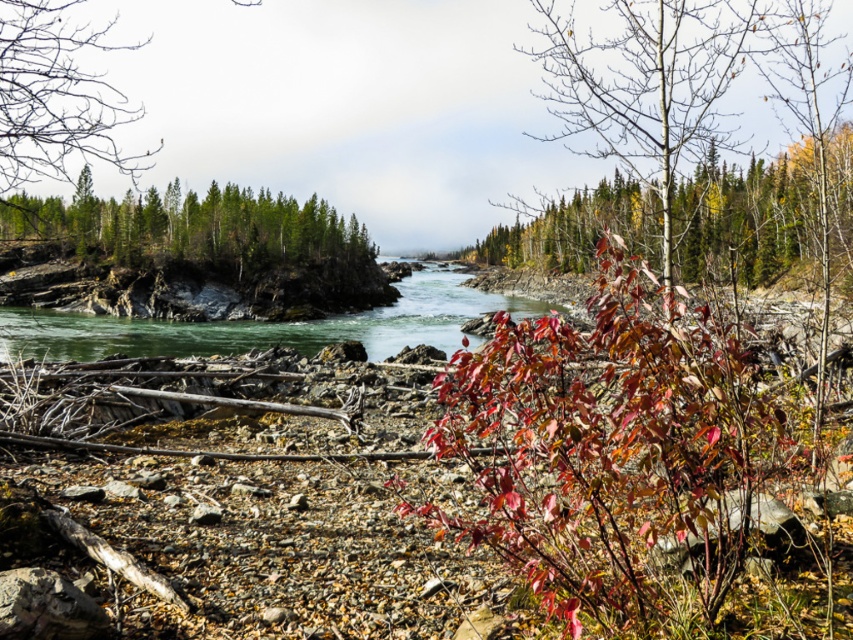
Who is positioned more to the left, leaves at upper right or green smooth water at center?

green smooth water at center

Looking at this image, is leaves at upper right thinner than green smooth water at center?

Yes.

Who is more forward, (843,140) or (79,339)?

Point (79,339) is in front.

At what (x,y) coordinates should I click in order to perform the action: click on leaves at upper right. Please return your answer as a coordinate pair (x, y). Looking at the image, I should click on (x=750, y=218).

In the scene shown: Is green matte trees at upper center to the left of green smooth water at center from the viewer's perspective?

Yes, green matte trees at upper center is to the left of green smooth water at center.

Is point (146, 227) positioned in front of point (148, 337)?

That is False.

Locate an element on the screen. The image size is (853, 640). green matte trees at upper center is located at coordinates (189, 227).

Which is below, leaves at upper right or green matte trees at upper center?

green matte trees at upper center

Is leaves at upper right positioned at the back of green matte trees at upper center?

No, it is not.

Locate an element on the screen. The width and height of the screenshot is (853, 640). leaves at upper right is located at coordinates (750, 218).

Where is `leaves at upper right`? leaves at upper right is located at coordinates [750, 218].